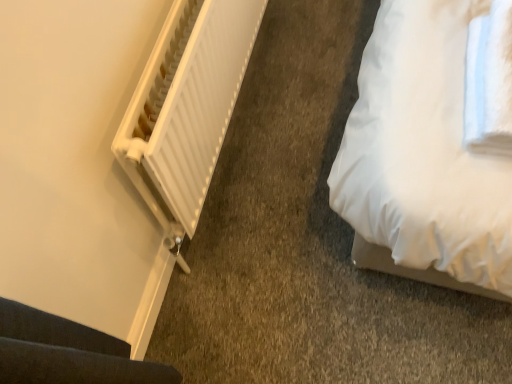
Image resolution: width=512 pixels, height=384 pixels. Describe the element at coordinates (186, 109) in the screenshot. I see `white matte radiator at left` at that location.

At what (x,y) coordinates should I click in order to perform the action: click on white matte radiator at left. Please return your answer as a coordinate pair (x, y). Looking at the image, I should click on (186, 109).

At what (x,y) coordinates should I click in order to perform the action: click on white matte radiator at left. Please return your answer as a coordinate pair (x, y). Looking at the image, I should click on (186, 109).